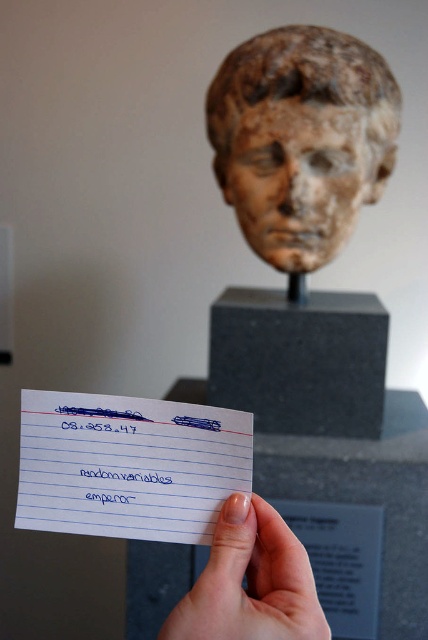
Is speckled stone head at upper center further to camera compared to blue ink signature at center?

Yes, it is behind blue ink signature at center.

Which of these two, speckled stone head at upper center or blue ink signature at center, stands taller?

Standing taller between the two is speckled stone head at upper center.

Which is in front, point (299, 244) or point (127, 428)?

Point (127, 428)

Where is `speckled stone head at upper center`? speckled stone head at upper center is located at coordinates (302, 140).

Measure the distance between pale skin at center and blue ink signature at center.

A distance of 4.73 inches exists between pale skin at center and blue ink signature at center.

Does pale skin at center have a greater height compared to blue ink signature at center?

Yes, pale skin at center is taller than blue ink signature at center.

Locate an element on the screen. pale skin at center is located at coordinates (250, 580).

Who is shorter, speckled stone head at upper center or white lined paper at center?

white lined paper at center

Where is `speckled stone head at upper center`? speckled stone head at upper center is located at coordinates (302, 140).

Identify the location of speckled stone head at upper center. Image resolution: width=428 pixels, height=640 pixels. (302, 140).